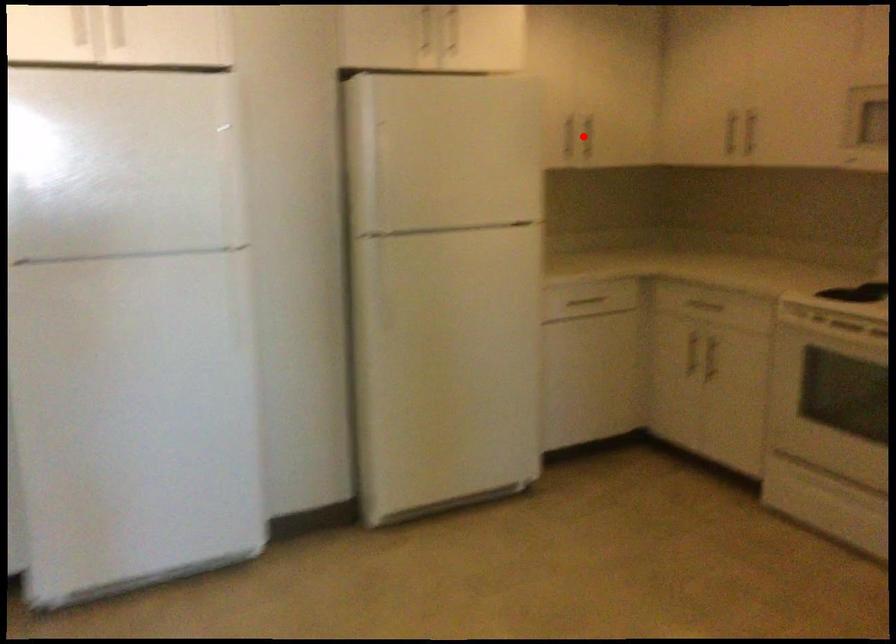
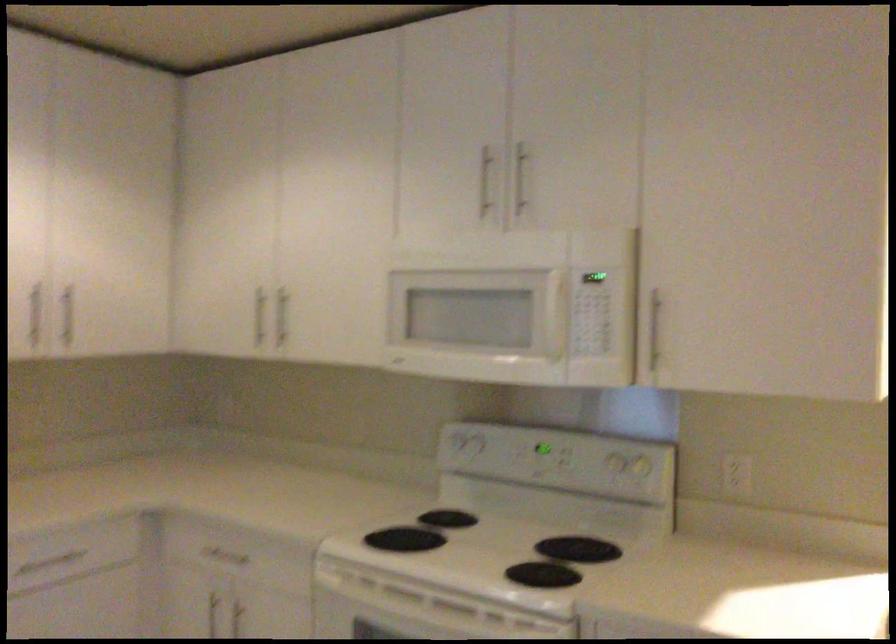
In the second image, find the point that corresponds to the highlighted location in the first image.

(66, 316)